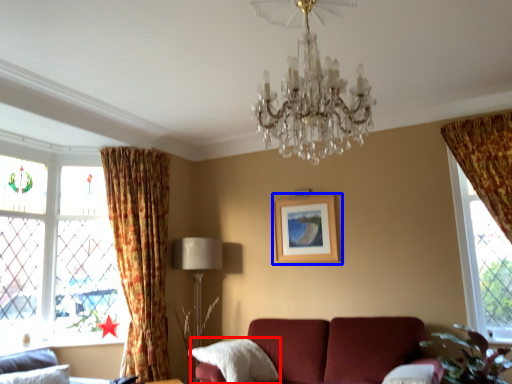
Question: Which object is closer to the camera taking this photo, pillow (highlighted by a red box) or picture frame (highlighted by a blue box)?

Choices:
 (A) pillow
 (B) picture frame

Answer: (A)